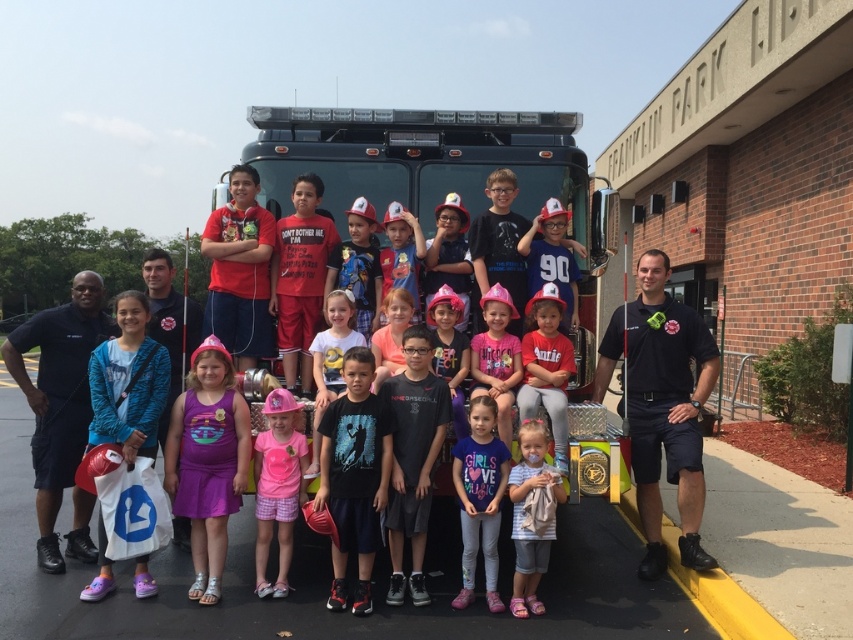
Question: Which is farther from the white cotton shirt at center?

Choices:
 (A) pink fabric hat at center
 (B) pink matte fire helmet at center

Answer: (A)

Question: Which point is closer to the camera?

Choices:
 (A) (541, 563)
 (B) (560, 353)
 (C) (276, 444)
 (D) (509, 337)

Answer: (A)

Question: Is pink matte fire helmet at center to the right of pink fabric hat at center from the viewer's perspective?

Choices:
 (A) no
 (B) yes

Answer: (B)

Question: Does pink fabric shirt at center lie behind pink matte fire helmet at center?

Choices:
 (A) no
 (B) yes

Answer: (A)

Question: Which is nearer to the pink fabric hat at center?

Choices:
 (A) white cotton shirt at center
 (B) pink fabric dress at center
 (C) pink matte fire helmet at center
 (D) pink matte shirt at center

Answer: (C)

Question: Where is pink matte shirt at center located in relation to pink fabric hat at center in the image?

Choices:
 (A) right
 (B) left

Answer: (B)